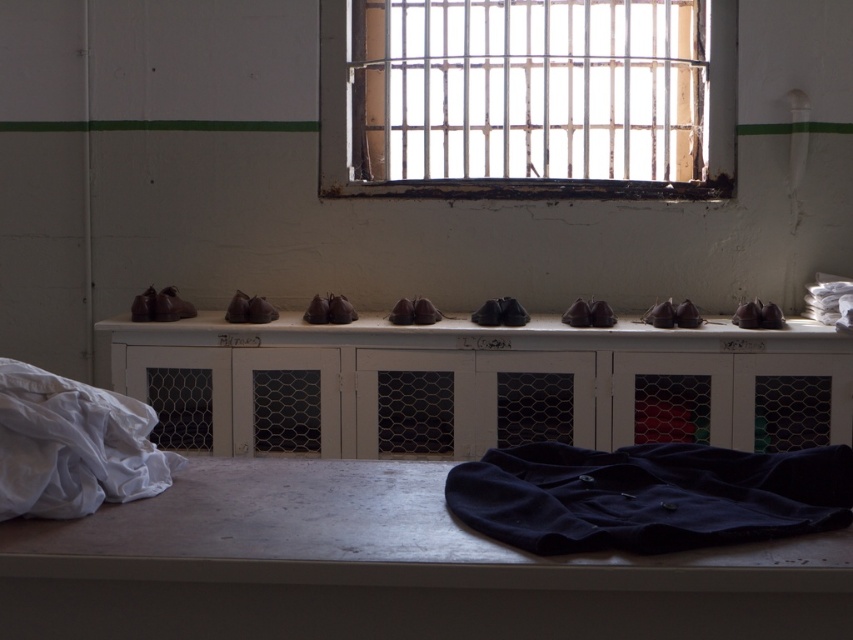
This screenshot has height=640, width=853. What do you see at coordinates (527, 97) in the screenshot?
I see `metallic bars at upper center` at bounding box center [527, 97].

Who is more forward, (550, 33) or (596, 472)?

Point (596, 472)

Which is behind, point (554, 76) or point (624, 538)?

Positioned behind is point (554, 76).

Image resolution: width=853 pixels, height=640 pixels. What are the coordinates of `metallic bars at upper center` in the screenshot? It's located at (527, 97).

Who is positioned more to the left, velvet dark blue shirt at center or white cotton cloth at lower left?

From the viewer's perspective, white cotton cloth at lower left appears more on the left side.

Can you confirm if velvet dark blue shirt at center is shorter than white cotton cloth at lower left?

Yes, velvet dark blue shirt at center is shorter than white cotton cloth at lower left.

Which is in front, point (730, 451) or point (107, 456)?

Point (107, 456) is in front.

I want to click on velvet dark blue shirt at center, so point(648,497).

Which is below, metallic bars at upper center or white cotton cloth at lower left?

white cotton cloth at lower left

Can you confirm if metallic bars at upper center is positioned below white cotton cloth at lower left?

Actually, metallic bars at upper center is above white cotton cloth at lower left.

At what (x,y) coordinates should I click in order to perform the action: click on metallic bars at upper center. Please return your answer as a coordinate pair (x, y). Looking at the image, I should click on (527, 97).